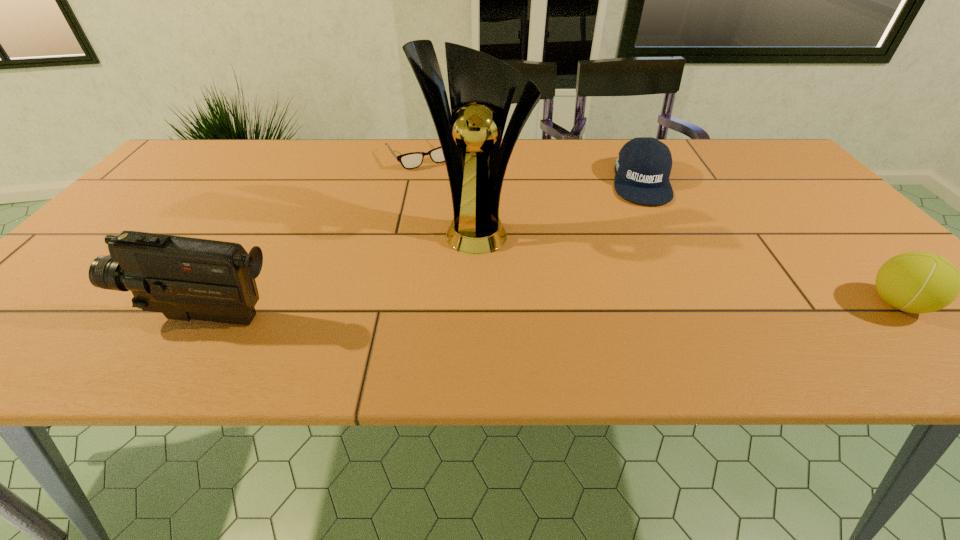
At what (x,y) coordinates should I click in order to perform the action: click on the leftmost object. Please return your answer as a coordinate pair (x, y). This screenshot has height=540, width=960. Looking at the image, I should click on (184, 278).

This screenshot has height=540, width=960. I want to click on the second tallest object, so click(x=184, y=278).

Find the location of `tennis ball`. tennis ball is located at coordinates (915, 282).

Where is `the second object from right to left`? Image resolution: width=960 pixels, height=540 pixels. the second object from right to left is located at coordinates (643, 166).

You are a GUI agent. You are given a task and a screenshot of the screen. Output one action in this format:
    pyautogui.click(x=<x>, y=<y>)
    Task: Click on the baseball cap
    
    Given the screenshot: What is the action you would take?
    pyautogui.click(x=643, y=166)

Where is `spectacles`? The height and width of the screenshot is (540, 960). spectacles is located at coordinates (412, 160).

Identify the location of the tallest object. This screenshot has height=540, width=960. (481, 87).

What are the coordinates of `vacant position located on the front-facing side of the camcorder` in the screenshot? It's located at (85, 318).

The image size is (960, 540). In order to click on vacant space located on the front-facing side of the camcorder in this screenshot , I will do `click(60, 318)`.

In order to click on free space located 0.110m on the front-facing side of the camcorder in this screenshot , I will do `click(75, 318)`.